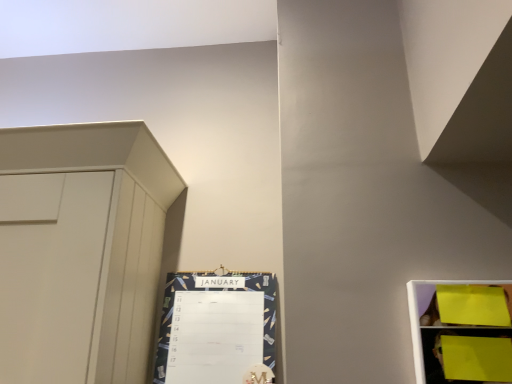
The height and width of the screenshot is (384, 512). Describe the element at coordinates (461, 331) in the screenshot. I see `yellow paper at right` at that location.

Image resolution: width=512 pixels, height=384 pixels. In order to click on yellow paper at right in this screenshot , I will do `click(461, 331)`.

What do you see at coordinates (216, 327) in the screenshot?
I see `dark blue textured calendar at center-left` at bounding box center [216, 327].

Locate an element on the screen. dark blue textured calendar at center-left is located at coordinates (216, 327).

This screenshot has width=512, height=384. In order to click on yellow paper at right in this screenshot , I will do `click(461, 331)`.

Which object is positioned more to the right, dark blue textured calendar at center-left or yellow paper at right?

yellow paper at right.

Who is more distant, dark blue textured calendar at center-left or yellow paper at right?

dark blue textured calendar at center-left is further away from the camera.

Which is less distant, [198,284] or [466,345]?

Point [466,345]

From the image's perspective, which object appears higher, dark blue textured calendar at center-left or yellow paper at right?

yellow paper at right is shown above in the image.

From a real-world perspective, is dark blue textured calendar at center-left physically located above or below yellow paper at right?

dark blue textured calendar at center-left is situated higher than yellow paper at right in the real world.

Considering the relative sizes of dark blue textured calendar at center-left and yellow paper at right in the image provided, is dark blue textured calendar at center-left thinner than yellow paper at right?

Indeed, dark blue textured calendar at center-left has a lesser width compared to yellow paper at right.

Considering the sizes of objects dark blue textured calendar at center-left and yellow paper at right in the image provided, who is shorter, dark blue textured calendar at center-left or yellow paper at right?

With less height is yellow paper at right.

Which of these two, dark blue textured calendar at center-left or yellow paper at right, is smaller?

yellow paper at right is smaller.

Is dark blue textured calendar at center-left spatially inside yellow paper at right, or outside of it?

dark blue textured calendar at center-left is spatially situated outside yellow paper at right.

Looking at this image, is dark blue textured calendar at center-left beside yellow paper at right?

No, dark blue textured calendar at center-left is not in contact with yellow paper at right.

Is dark blue textured calendar at center-left positioned with its back to yellow paper at right?

No, dark blue textured calendar at center-left is not facing away from yellow paper at right.

How many degrees apart are the facing directions of dark blue textured calendar at center-left and yellow paper at right?

There is a 0.0172-degree angle between the facing directions of dark blue textured calendar at center-left and yellow paper at right.

Image resolution: width=512 pixels, height=384 pixels. What are the coordinates of `shelf that appears on the right of dark blue textured calendar at center-left` in the screenshot? It's located at (461, 331).

Is yellow paper at right at the left side of dark blue textured calendar at center-left?

No, yellow paper at right is not to the left of dark blue textured calendar at center-left.

Is yellow paper at right behind dark blue textured calendar at center-left?

No, yellow paper at right is closer to the camera.

Considering the positions of point (434, 329) and point (199, 370), is point (434, 329) closer or farther from the camera than point (199, 370)?

Point (434, 329) is closer to the camera than point (199, 370).

From the image's perspective, who appears lower, yellow paper at right or dark blue textured calendar at center-left?

dark blue textured calendar at center-left.

From a real-world perspective, which object rests below the other?

yellow paper at right, from a real-world perspective.

Is yellow paper at right wider or thinner than dark blue textured calendar at center-left?

yellow paper at right is wider than dark blue textured calendar at center-left.

Is yellow paper at right shorter than dark blue textured calendar at center-left?

Yes, yellow paper at right is shorter than dark blue textured calendar at center-left.

Who is smaller, yellow paper at right or dark blue textured calendar at center-left?

yellow paper at right.

Is yellow paper at right not inside dark blue textured calendar at center-left?

Yes.

Is yellow paper at right far away from dark blue textured calendar at center-left?

No, there isn't a large distance between yellow paper at right and dark blue textured calendar at center-left.

Is yellow paper at right turned away from dark blue textured calendar at center-left?

No, yellow paper at right is not facing the opposite direction of dark blue textured calendar at center-left.

How many degrees apart are the facing directions of yellow paper at right and dark blue textured calendar at center-left?

The angle between the facing direction of yellow paper at right and the facing direction of dark blue textured calendar at center-left is 0.0172 degrees.

How much distance is there between yellow paper at right and dark blue textured calendar at center-left?

The distance of yellow paper at right from dark blue textured calendar at center-left is 19.42 inches.

You are a GUI agent. You are given a task and a screenshot of the screen. Output one action in this format:
    pyautogui.click(x=<x>, y=<y>)
    Task: Click on the bulletin board that is below the yellow paper at right (from the image's perspective)
    The image size is (512, 384).
    Given the screenshot: What is the action you would take?
    pyautogui.click(x=216, y=327)

Find the location of `shelf above the dark blue textured calendar at center-left (from the image's perspective)`. shelf above the dark blue textured calendar at center-left (from the image's perspective) is located at coordinates (461, 331).

Image resolution: width=512 pixels, height=384 pixels. In order to click on shelf on the right of dark blue textured calendar at center-left in this screenshot , I will do `click(461, 331)`.